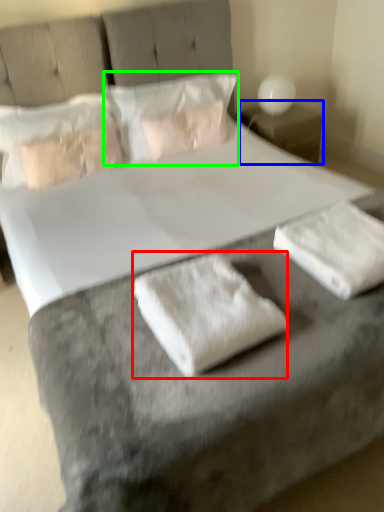
Question: Based on their relative distances, which object is nearer to material (highlighted by a red box)? Choose from nightstand (highlighted by a blue box) and pillow (highlighted by a green box).

Choices:
 (A) nightstand
 (B) pillow

Answer: (B)